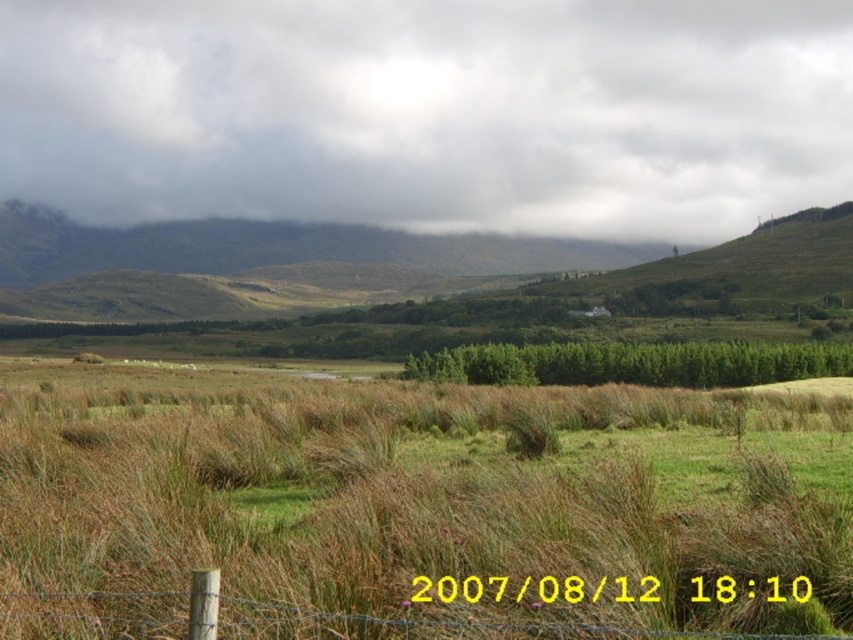
You are standing in the middle of the field and see the brown dry grass at center and the brown wooden fence at lower center. Which object is closer to your right side?

The brown wooden fence at lower center is closer to your right side because the brown dry grass at center is to the left of it.

From the picture: You are standing in a field and want to reach a specific point marked at coordinates point (x=300, y=552). If you can walk 25 feet in a straight line, will you be able to reach that point?

The distance of point (x=300, y=552) from viewer is 23.18 feet, so yes, you can reach it since it is within your 25 feet walking range.